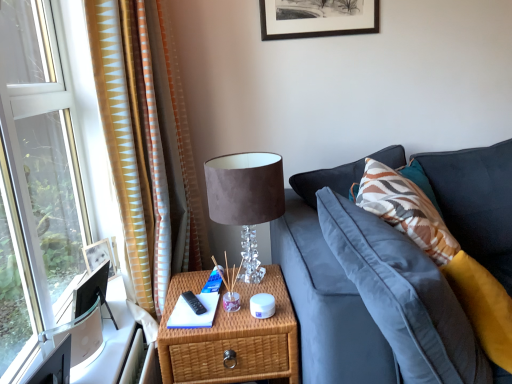
Find the location of a particular element. Image resolution: width=512 pixels, height=384 pixels. free space above velvet lampshade at upper center (from a real-world perspective) is located at coordinates (241, 158).